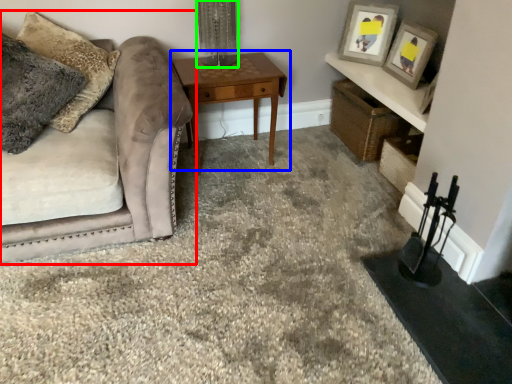
Question: Which is farther away from studio couch (highlighted by a red box)? table (highlighted by a blue box) or table lamp (highlighted by a green box)?

Choices:
 (A) table
 (B) table lamp

Answer: (B)